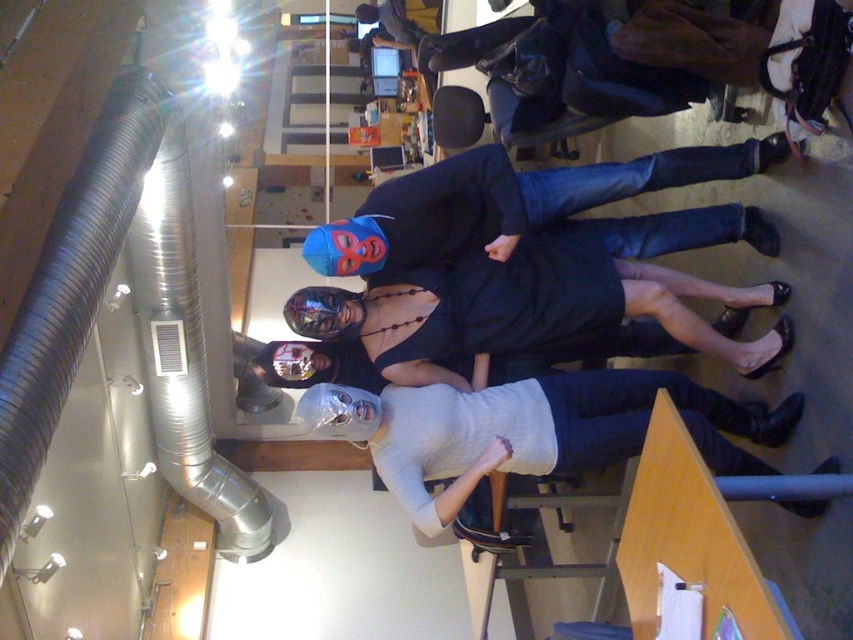
Question: Observing the image, what is the correct spatial positioning of white matte mask at center in reference to matte black mask at center?

Choices:
 (A) left
 (B) right

Answer: (B)

Question: Can you confirm if white matte mask at center is bigger than matte black mask at center?

Choices:
 (A) no
 (B) yes

Answer: (B)

Question: Is white matte mask at center wider than matte black mask at center?

Choices:
 (A) no
 (B) yes

Answer: (A)

Question: Among these objects, which one is nearest to the camera?

Choices:
 (A) white matte mask at center
 (B) matte black mask at center

Answer: (A)